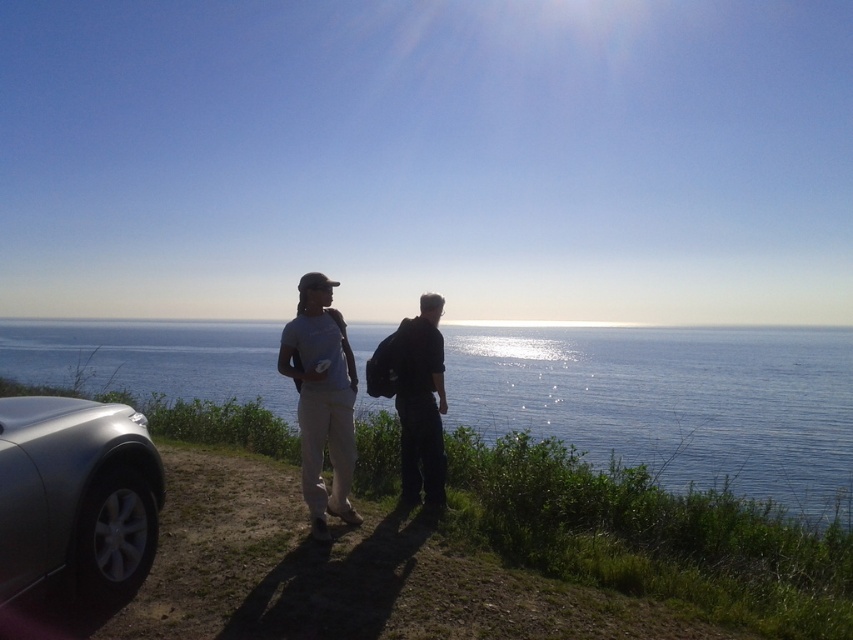
Can you confirm if light gray cotton pants at center is bigger than black matte backpack at center?

Yes, light gray cotton pants at center is bigger than black matte backpack at center.

Who is shorter, light gray cotton pants at center or black matte backpack at center?

Standing shorter between the two is black matte backpack at center.

Who is more distant from viewer, (322,428) or (430,442)?

The point (430,442) is behind.

Identify the location of light gray cotton pants at center. (322, 400).

Looking at this image, is silver metallic car at lower left behind light gray cotton pants at center?

No, it is in front of light gray cotton pants at center.

Is point (18, 432) positioned before point (349, 451)?

Yes, point (18, 432) is in front of point (349, 451).

Who is more forward, (44, 484) or (346, 481)?

Point (44, 484)

Identify the location of silver metallic car at lower left. The width and height of the screenshot is (853, 640). (76, 500).

Who is lower down, blue water at center or silver metallic car at lower left?

silver metallic car at lower left is below.

Does blue water at center appear on the left side of silver metallic car at lower left?

Indeed, blue water at center is positioned on the left side of silver metallic car at lower left.

What are the coordinates of `blue water at center` in the screenshot? It's located at (672, 401).

This screenshot has width=853, height=640. I want to click on blue water at center, so click(672, 401).